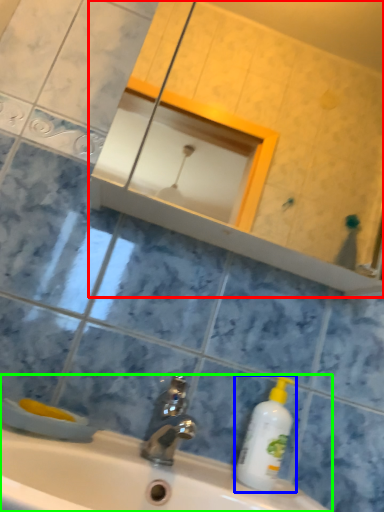
Question: Based on their relative distances, which object is nearer to mirror (highlighted by a red box)? Choose from cleaning product (highlighted by a blue box) and sink (highlighted by a green box).

Choices:
 (A) cleaning product
 (B) sink

Answer: (B)